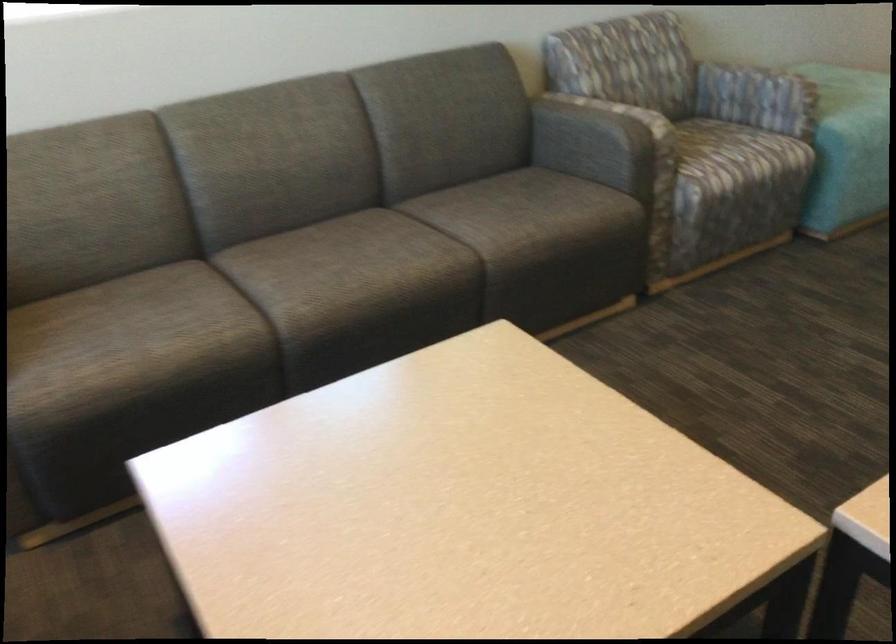
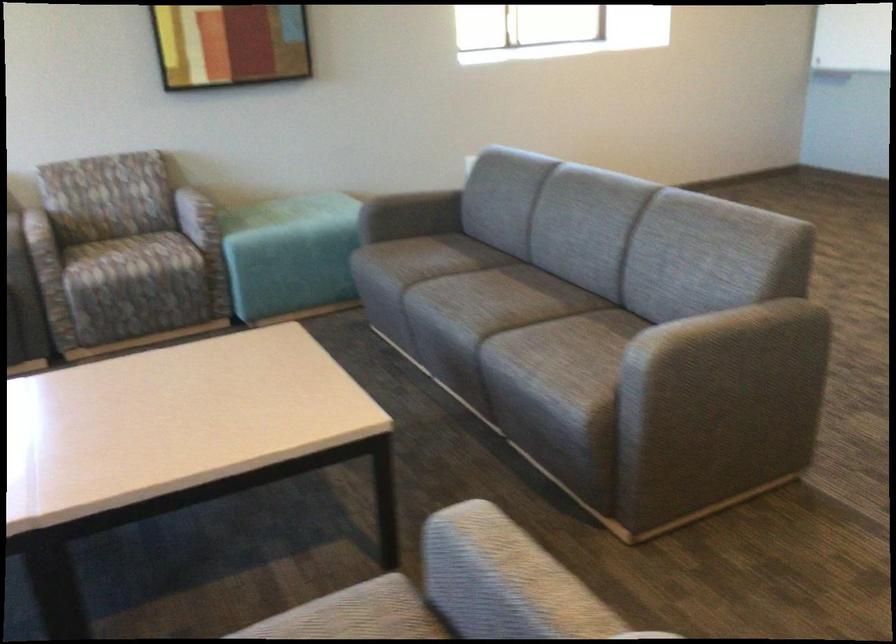
Question: In a continuous first-person perspective shot, in which direction is the camera moving?

Choices:
 (A) Left
 (B) Right
 (C) Forward
 (D) Backward

Answer: (B)